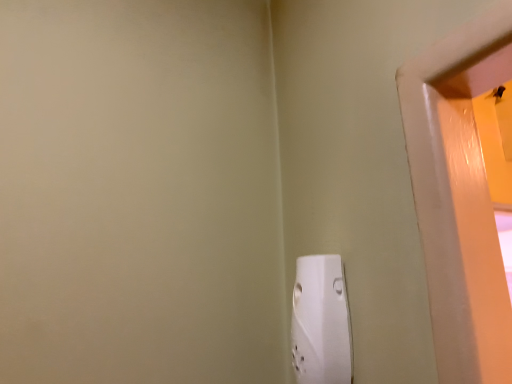
What do you see at coordinates (320, 322) in the screenshot?
I see `white plastic power plug at lower right` at bounding box center [320, 322].

The height and width of the screenshot is (384, 512). What are the coordinates of `white plastic power plug at lower right` in the screenshot? It's located at (320, 322).

The height and width of the screenshot is (384, 512). Find the location of `white plastic power plug at lower right`. white plastic power plug at lower right is located at coordinates (320, 322).